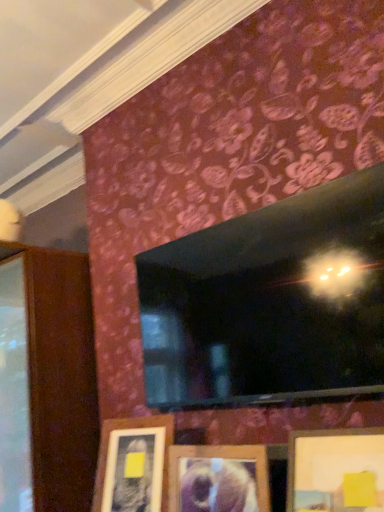
Question: Considering the positions of wooden picture frame at center, the second picture frame positioned from the right, and wooden picture frame at lower center, the first picture frame viewed from the right, in the image, is wooden picture frame at center, the second picture frame positioned from the right, taller or shorter than wooden picture frame at lower center, the first picture frame viewed from the right,?

Choices:
 (A) tall
 (B) short

Answer: (B)

Question: Considering the positions of wooden picture frame at center, the second picture frame positioned from the right, and wooden picture frame at lower center, the first picture frame viewed from the right, in the image, is wooden picture frame at center, the second picture frame positioned from the right, wider or thinner than wooden picture frame at lower center, the first picture frame viewed from the right,?

Choices:
 (A) thin
 (B) wide

Answer: (A)

Question: Considering the real-world distances, which object is closest to the wooden picture frame at center, the second picture frame from the left?

Choices:
 (A) wooden picture frame at lower center, the first picture frame viewed from the right
 (B) wooden picture frame at lower center, the 3th picture frame viewed from the right

Answer: (B)

Question: Estimate the real-world distances between objects in this image. Which object is closer to the wooden picture frame at center, the second picture frame positioned from the right?

Choices:
 (A) wooden picture frame at lower center, the first picture frame viewed from the right
 (B) wooden picture frame at lower center, which is the first picture frame in left-to-right order

Answer: (B)